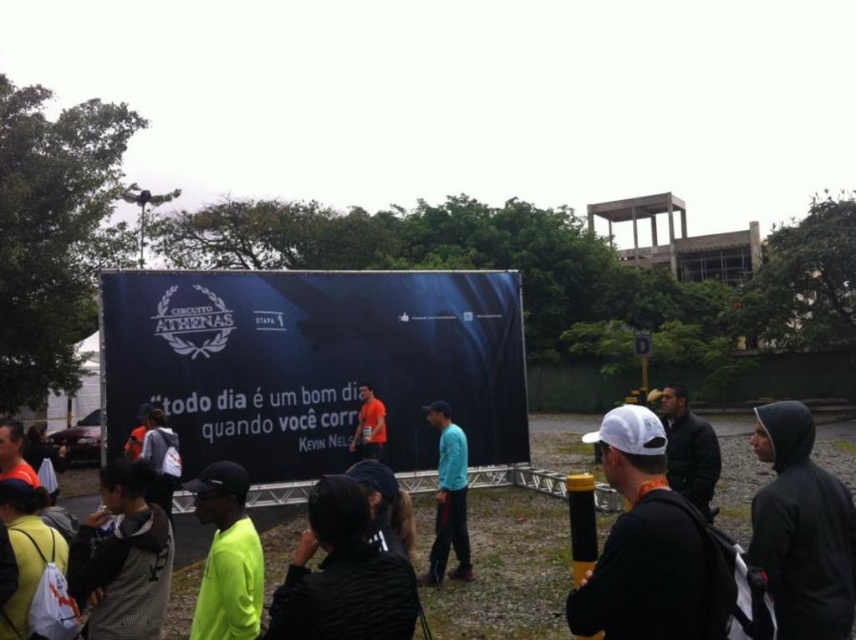
You are standing at the center of the image and see a point marked at coordinates (342,576). What object is located at that point?

The point at coordinates (342,576) corresponds to the black fabric at center.

You are organizing a photo shoot and need to place a large equipment box that is 1.2 meters wide. You have space between the gray textured jacket at lower left and the neon yellow fabric at center. Can the box fit in that space?

The gray textured jacket at lower left is wider than the neon yellow fabric at center. Therefore, the space between them may not be sufficient to accommodate the 1.2 meter wide equipment box. Measure the exact distance before placing the box.

You are standing at the event and want to take a photo of both the point at coordinates (x=423, y=432) and the point at (x=369, y=456). Which point should you position closer to the camera to ensure both are visible in the frame?

You should position the point at (x=369, y=456) closer to the camera because point (x=423, y=432) is behind point (x=369, y=456), so moving the front point forward ensures both are visible.